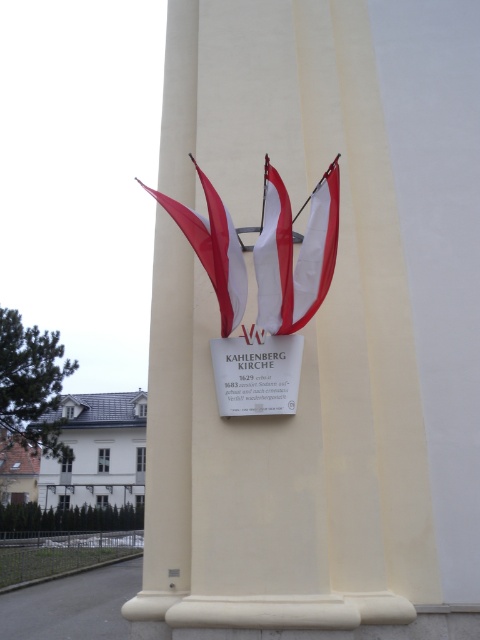
You are standing 5 meters away from the column with the plaque. If you move forward 0.4 meters, will you be closer to the point at coordinates point [193,216]?

The distance of point [193,216] from viewer is 4.61 meters. Moving forward 0.4 meters reduces your distance to 4.21 meters, which is closer to the point [193,216].